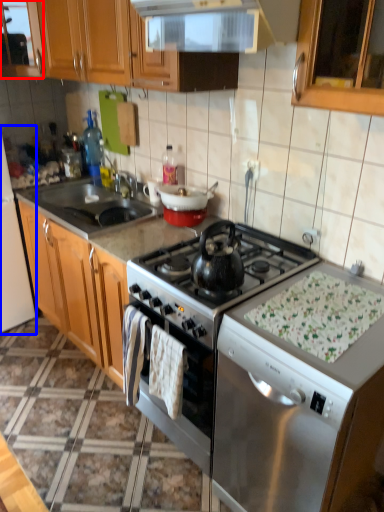
Question: Which of the following is the farthest to the observer, cabinetry (highlighted by a red box) or appliance (highlighted by a blue box)?

Choices:
 (A) cabinetry
 (B) appliance

Answer: (A)